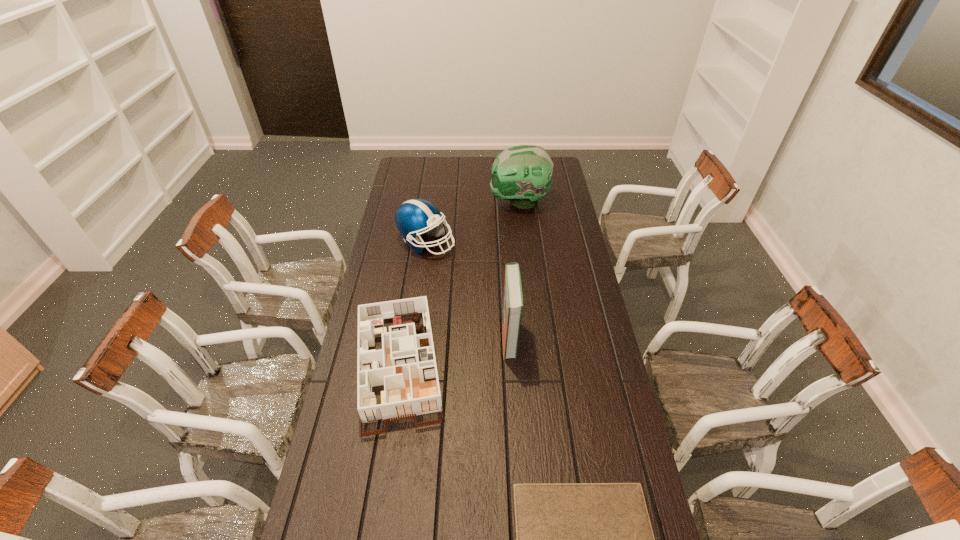
Identify the location of vacant space at the far left corner of the desktop. (396, 177).

The image size is (960, 540). Identify the location of free space between the hardback book and the third tallest object. (468, 290).

The width and height of the screenshot is (960, 540). What are the coordinates of `empty space between the taller football helmet and the dollhouse` in the screenshot? It's located at (459, 284).

Find the location of `vacant space that's between the dollhouse and the hardback book`. vacant space that's between the dollhouse and the hardback book is located at coordinates (454, 352).

Where is `free space between the third shortest object and the hardback book`? free space between the third shortest object and the hardback book is located at coordinates (468, 290).

Where is `object that can be found as the second closest to the shortest object`? Image resolution: width=960 pixels, height=540 pixels. object that can be found as the second closest to the shortest object is located at coordinates (513, 300).

Locate which object ranks second in proximity to the paperback book. Please provide its 2D coordinates. Your answer should be formatted as a tuple, i.e. [(x, y)], where the tuple contains the x and y coordinates of a point satisfying the conditions above.

[(513, 300)]